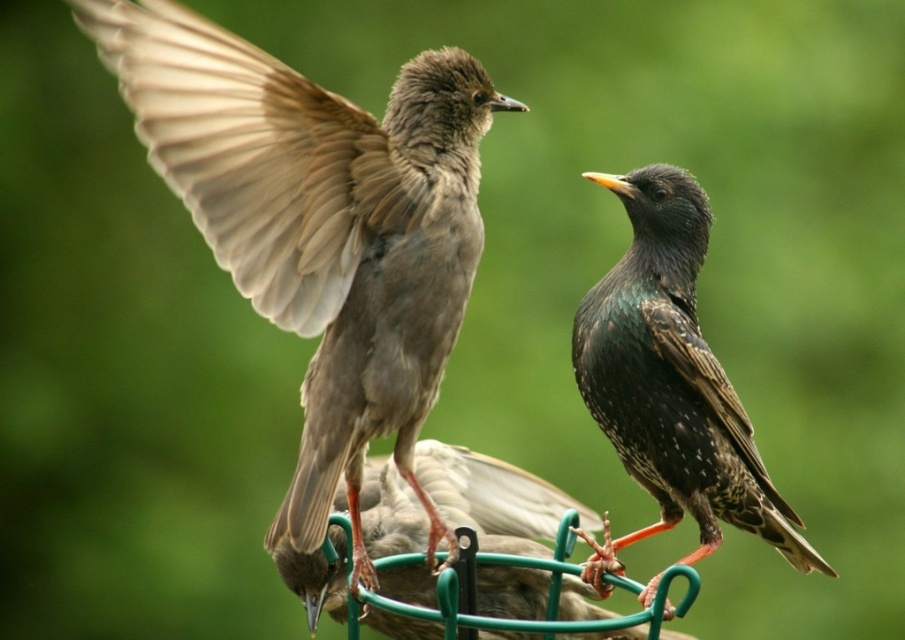
Is point (448, 141) more distant than point (674, 422)?

No, (448, 141) is in front of (674, 422).

Who is shorter, brown feathered bird at left or shiny black bird at center?

shiny black bird at center

Between point (363, 218) and point (582, 536), which one is positioned behind?

Positioned behind is point (582, 536).

Locate an element on the screen. brown feathered bird at left is located at coordinates (320, 227).